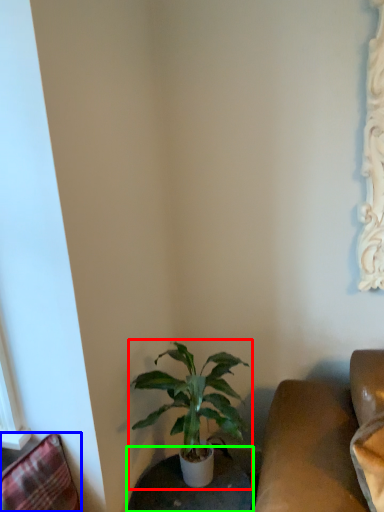
Question: Estimate the real-world distances between objects in this image. Which object is farther from houseplant (highlighted by a red box), swivel chair (highlighted by a blue box) or round table (highlighted by a green box)?

Choices:
 (A) swivel chair
 (B) round table

Answer: (A)